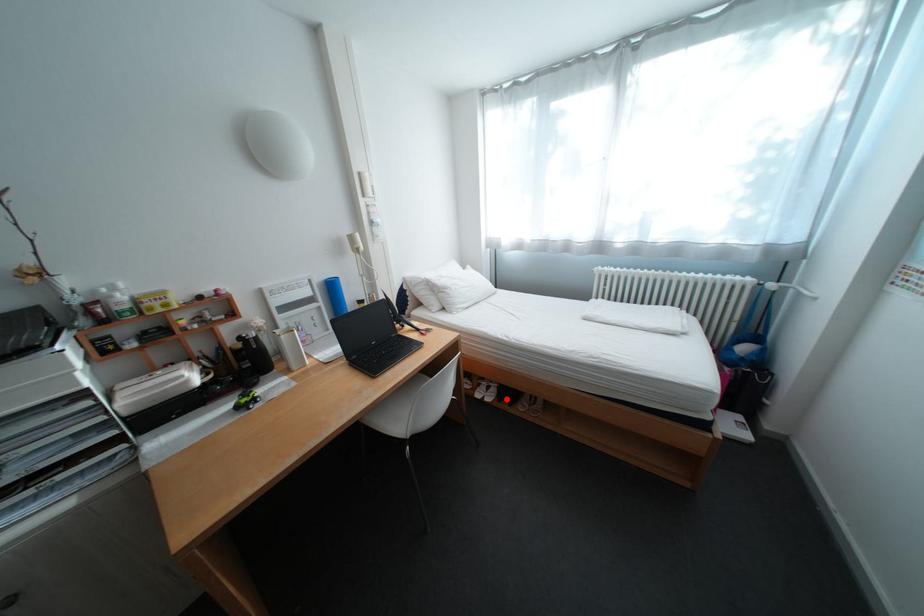
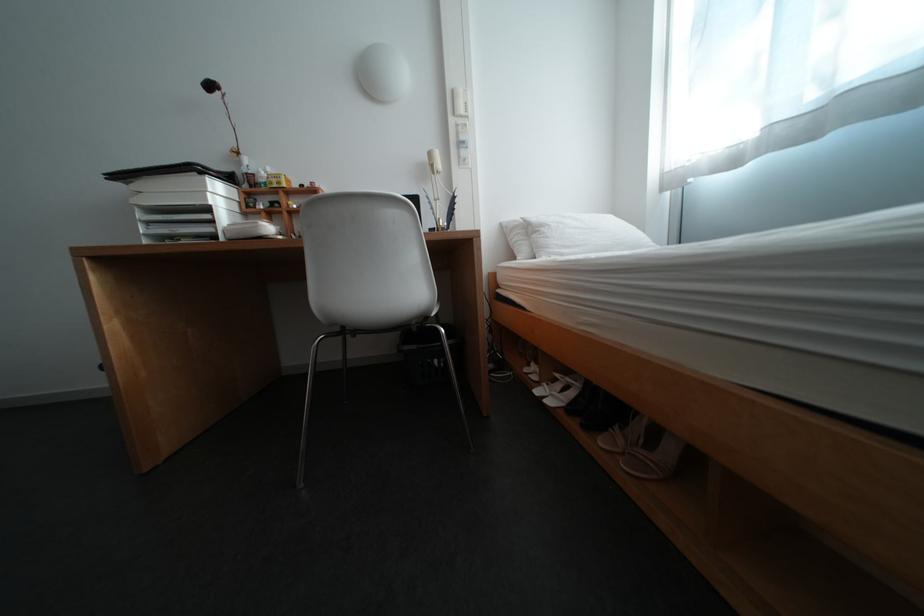
Where in the second image is the point corresponding to the highlighted location from the first image?

(576, 406)